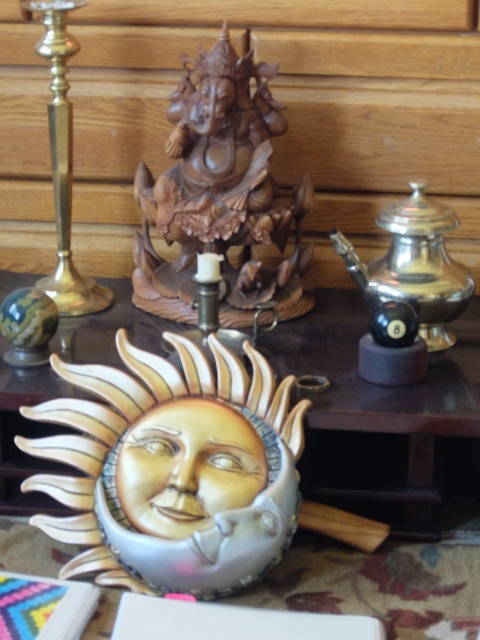
You are arranging items on a table and need to place a new item between the porcelain sun face at center and the silver metallic teapot at right. Based on their positions, which item is closer to you, the observer?

The porcelain sun face at center is closer to you because it is in front of the silver metallic teapot at right.